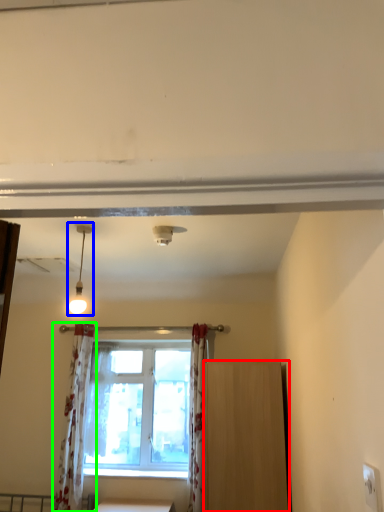
Question: Based on their relative distances, which object is nearer to furniture (highlighted by a red box)? Choose from light fixture (highlighted by a blue box) and curtain (highlighted by a green box).

Choices:
 (A) light fixture
 (B) curtain

Answer: (A)